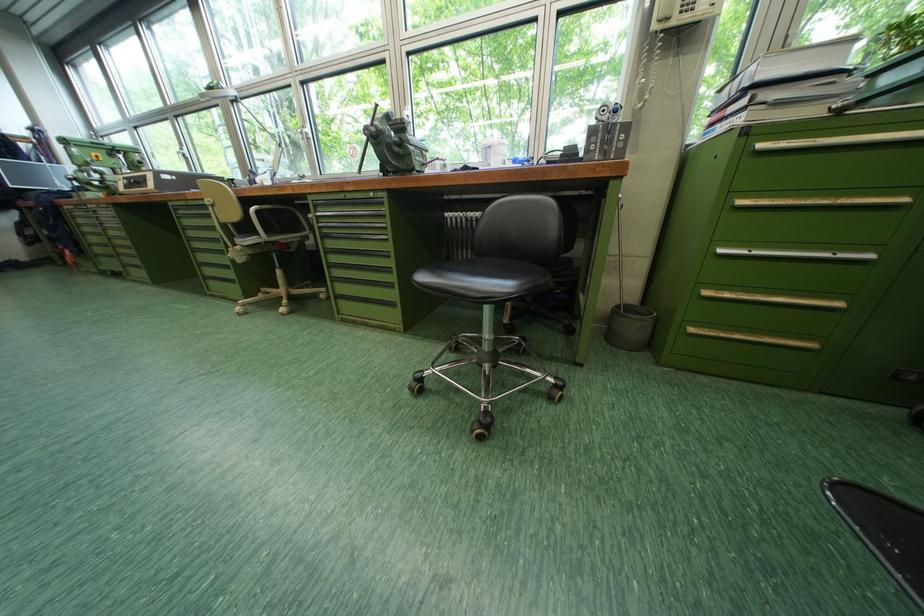
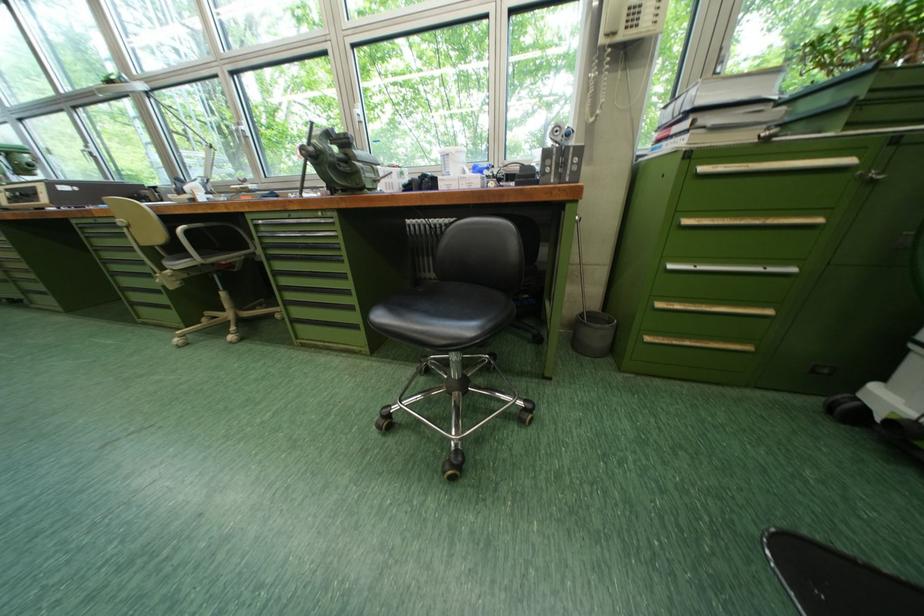
Find the pixel in the second image that matches the point at 752,204 in the first image.

(698, 224)